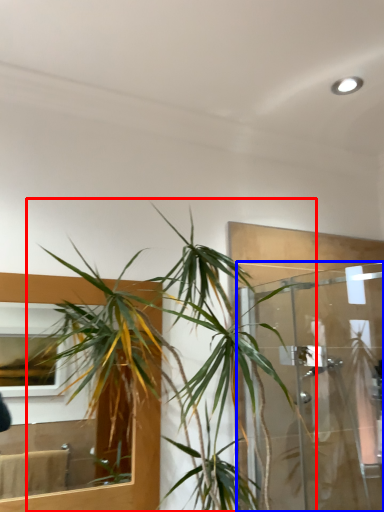
Question: Which object appears closest to the camera in this image, houseplant (highlighted by a red box) or glass door (highlighted by a blue box)?

Choices:
 (A) houseplant
 (B) glass door

Answer: (A)